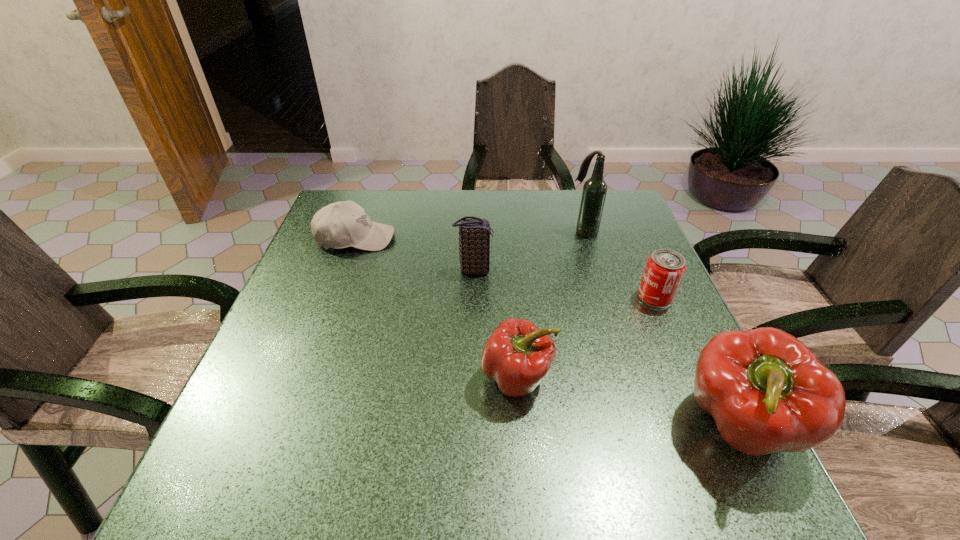
Identify the location of object that stands as the fifth closest to the baseball cap. (766, 390).

The width and height of the screenshot is (960, 540). Find the location of `blank area in the image that satisfies the following two spatial constraints: 1. on the back side of the can; 2. with the zip open on the clutch bag`. blank area in the image that satisfies the following two spatial constraints: 1. on the back side of the can; 2. with the zip open on the clutch bag is located at coordinates (643, 270).

At what (x,y) coordinates should I click in order to perform the action: click on free space that satisfies the following two spatial constraints: 1. on the back side of the second tallest object; 2. on the front-facing side of the leftmost object. Please return your answer as a coordinate pair (x, y). Looking at the image, I should click on (648, 238).

You are a GUI agent. You are given a task and a screenshot of the screen. Output one action in this format:
    pyautogui.click(x=<x>, y=<y>)
    Task: Click on the vacant region that satisfies the following two spatial constraints: 1. on the back side of the shorter pepper; 2. on the front-facing side of the leftmost object
    The width and height of the screenshot is (960, 540).
    Given the screenshot: What is the action you would take?
    pyautogui.click(x=507, y=238)

Identify the location of free space that satisfies the following two spatial constraints: 1. on the front side of the beer bottle; 2. on the right side of the second tallest object. (642, 426).

Find the location of a particular element. This screenshot has height=540, width=960. free space in the image that satisfies the following two spatial constraints: 1. with the zip open on the can; 2. on the left side of the clutch bag is located at coordinates (473, 297).

Where is `free point that satisfies the following two spatial constraints: 1. on the front side of the tallest object; 2. on the front-facing side of the baseball cap`? free point that satisfies the following two spatial constraints: 1. on the front side of the tallest object; 2. on the front-facing side of the baseball cap is located at coordinates (586, 238).

Locate an element on the screen. The height and width of the screenshot is (540, 960). vacant region that satisfies the following two spatial constraints: 1. with the zip open on the shorter pepper; 2. on the right side of the clutch bag is located at coordinates (471, 377).